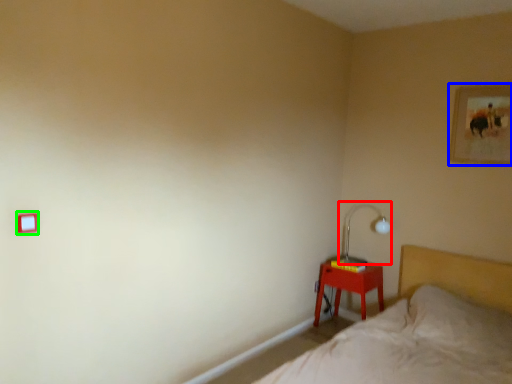
Question: Which object is the closest to the table lamp (highlighted by a red box)? Choose among these: picture frame (highlighted by a blue box) or light switch (highlighted by a green box).

Choices:
 (A) picture frame
 (B) light switch

Answer: (A)